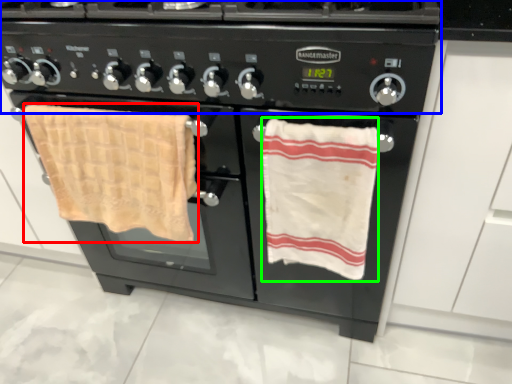
Question: Based on their relative distances, which object is nearer to beach towel (highlighted by a red box)? Choose from gas stove (highlighted by a blue box) and beach towel (highlighted by a green box).

Choices:
 (A) gas stove
 (B) beach towel

Answer: (A)